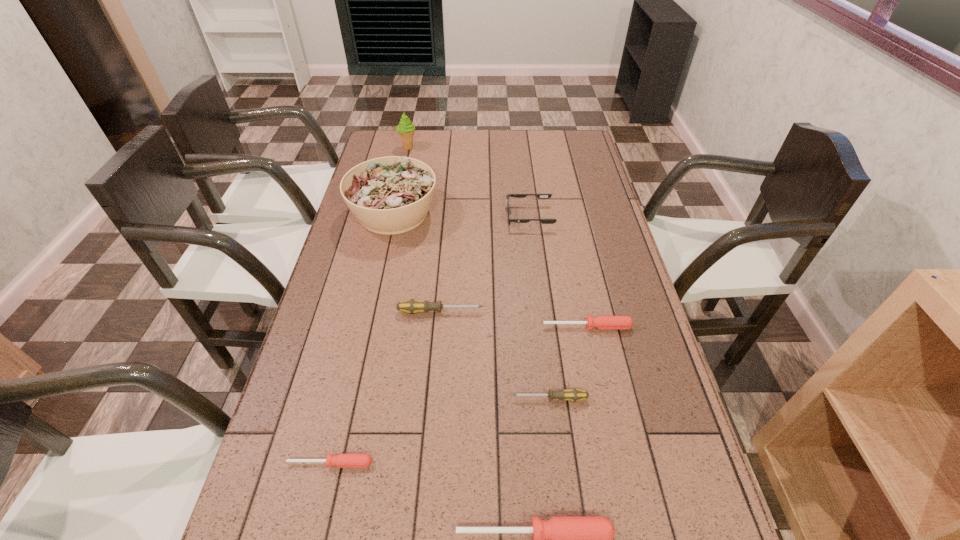
Where is `free spot that satisfies the following two spatial constraints: 1. on the front side of the salad; 2. on the left side of the green icecream`? The width and height of the screenshot is (960, 540). free spot that satisfies the following two spatial constraints: 1. on the front side of the salad; 2. on the left side of the green icecream is located at coordinates (394, 213).

Locate an element on the screen. This screenshot has width=960, height=540. vacant point that satisfies the following two spatial constraints: 1. at the tip of the farthest screwdriver; 2. on the back side of the farthest red screwdriver is located at coordinates 439,326.

Where is `vacant region that satisfies the following two spatial constraints: 1. on the front side of the fifth farthest object; 2. at the tip of the smaller gray screwdriver`? vacant region that satisfies the following two spatial constraints: 1. on the front side of the fifth farthest object; 2. at the tip of the smaller gray screwdriver is located at coordinates (x=603, y=399).